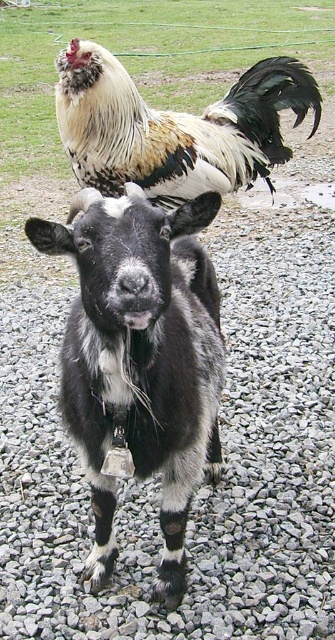
Question: Where is black and white fur goat at center located in relation to golden brown feathers at upper center in the image?

Choices:
 (A) right
 (B) left

Answer: (B)

Question: Does black and white fur goat at center have a greater width compared to golden brown feathers at upper center?

Choices:
 (A) no
 (B) yes

Answer: (A)

Question: Which point appears farthest from the camera in this image?

Choices:
 (A) (139, 416)
 (B) (125, 132)

Answer: (B)

Question: Considering the relative positions of black and white fur goat at center and golden brown feathers at upper center in the image provided, where is black and white fur goat at center located with respect to golden brown feathers at upper center?

Choices:
 (A) below
 (B) above

Answer: (A)